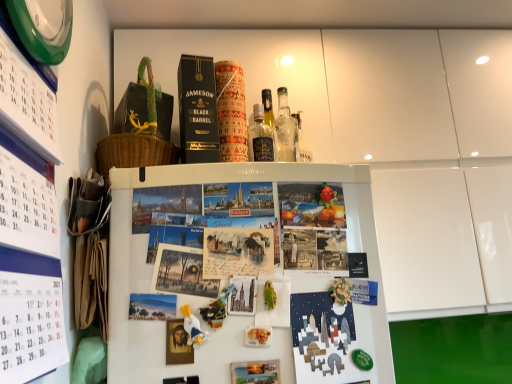
Question: Is matte paper postcard at upper center with green plastic clock at upper left?

Choices:
 (A) yes
 (B) no

Answer: (B)

Question: From the image's perspective, is matte paper postcard at upper center beneath green plastic clock at upper left?

Choices:
 (A) no
 (B) yes

Answer: (B)

Question: Is there a large distance between matte paper postcard at upper center and green plastic clock at upper left?

Choices:
 (A) yes
 (B) no

Answer: (B)

Question: Is matte paper postcard at upper center facing away from green plastic clock at upper left?

Choices:
 (A) yes
 (B) no

Answer: (B)

Question: From a real-world perspective, is matte paper postcard at upper center on top of green plastic clock at upper left?

Choices:
 (A) no
 (B) yes

Answer: (A)

Question: Is white matte refrigerator at center wider or thinner than matte paper postcard at upper center?

Choices:
 (A) thin
 (B) wide

Answer: (B)

Question: Do you think white matte refrigerator at center is within matte paper postcard at upper center, or outside of it?

Choices:
 (A) inside
 (B) outside

Answer: (B)

Question: From a real-world perspective, relative to matte paper postcard at upper center, is white matte refrigerator at center vertically above or below?

Choices:
 (A) below
 (B) above

Answer: (A)

Question: From the image's perspective, is white matte refrigerator at center located above or below matte paper postcard at upper center?

Choices:
 (A) below
 (B) above

Answer: (A)

Question: Is vintage paper postcard at center, which ranks as the 1th book cover in left-to-right order, wider or thinner than white matte refrigerator at center?

Choices:
 (A) wide
 (B) thin

Answer: (B)

Question: Is vintage paper postcard at center, which ranks as the first book cover in top-to-bottom order, in front of or behind white matte refrigerator at center in the image?

Choices:
 (A) behind
 (B) front

Answer: (A)

Question: From a real-world perspective, is vintage paper postcard at center, marked as the 2th book cover in a bottom-to-top arrangement, positioned above or below white matte refrigerator at center?

Choices:
 (A) below
 (B) above

Answer: (B)

Question: Is point (202, 294) closer or farther from the camera than point (295, 168)?

Choices:
 (A) farther
 (B) closer

Answer: (B)

Question: From a real-world perspective, is white paper calendar at left physically located above or below white matte refrigerator at center?

Choices:
 (A) below
 (B) above

Answer: (B)

Question: In the image, is white paper calendar at left positioned in front of or behind white matte refrigerator at center?

Choices:
 (A) front
 (B) behind

Answer: (A)